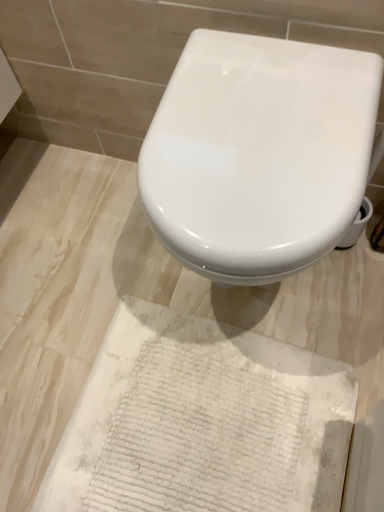
Question: Is white textured rug at lower center shorter than white glossy toilet at center?

Choices:
 (A) yes
 (B) no

Answer: (A)

Question: Is white textured rug at lower center smaller than white glossy toilet at center?

Choices:
 (A) yes
 (B) no

Answer: (A)

Question: Does white textured rug at lower center appear on the right side of white glossy toilet at center?

Choices:
 (A) no
 (B) yes

Answer: (A)

Question: Is white textured rug at lower center positioned with its back to white glossy toilet at center?

Choices:
 (A) yes
 (B) no

Answer: (B)

Question: From a real-world perspective, is white textured rug at lower center beneath white glossy toilet at center?

Choices:
 (A) no
 (B) yes

Answer: (B)

Question: Can you confirm if white textured rug at lower center is taller than white glossy toilet at center?

Choices:
 (A) yes
 (B) no

Answer: (B)

Question: Does white glossy toilet at center have a lesser width compared to white textured rug at lower center?

Choices:
 (A) yes
 (B) no

Answer: (A)

Question: From the image's perspective, is white glossy toilet at center below white textured rug at lower center?

Choices:
 (A) yes
 (B) no

Answer: (B)

Question: Is the depth of white glossy toilet at center greater than that of white textured rug at lower center?

Choices:
 (A) no
 (B) yes

Answer: (A)

Question: Is white glossy toilet at center bigger than white textured rug at lower center?

Choices:
 (A) no
 (B) yes

Answer: (B)

Question: Is white textured rug at lower center completely or partially inside white glossy toilet at center?

Choices:
 (A) no
 (B) yes

Answer: (A)

Question: Can you confirm if white glossy toilet at center is smaller than white textured rug at lower center?

Choices:
 (A) yes
 (B) no

Answer: (B)

Question: In the image, is white textured rug at lower center positioned in front of or behind white glossy toilet at center?

Choices:
 (A) behind
 (B) front

Answer: (A)